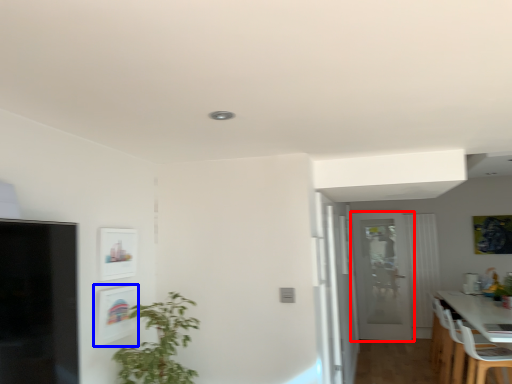
Question: Which object is closer to the camera taking this photo, door (highlighted by a red box) or picture frame (highlighted by a blue box)?

Choices:
 (A) door
 (B) picture frame

Answer: (B)